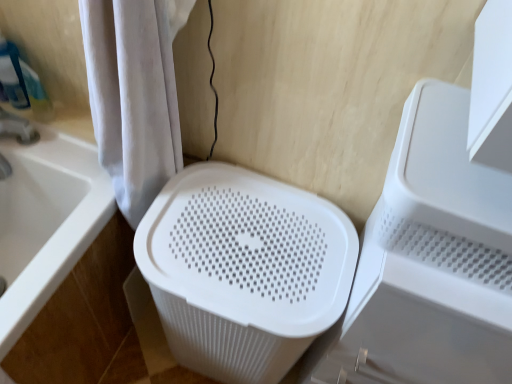
Question: Should I look upward or downward to see white plastic basket at center?

Choices:
 (A) down
 (B) up

Answer: (A)

Question: Considering the relative sizes of white plastic laundry basket at center and white plastic basket at center in the image provided, is white plastic laundry basket at center smaller than white plastic basket at center?

Choices:
 (A) yes
 (B) no

Answer: (B)

Question: Is white plastic laundry basket at center further to camera compared to white plastic basket at center?

Choices:
 (A) no
 (B) yes

Answer: (B)

Question: Considering the relative sizes of white plastic laundry basket at center and white plastic basket at center in the image provided, is white plastic laundry basket at center taller than white plastic basket at center?

Choices:
 (A) no
 (B) yes

Answer: (A)

Question: Considering the relative positions of white plastic laundry basket at center and white plastic basket at center in the image provided, is white plastic laundry basket at center to the left of white plastic basket at center from the viewer's perspective?

Choices:
 (A) yes
 (B) no

Answer: (A)

Question: Is white plastic laundry basket at center not close to white plastic basket at center?

Choices:
 (A) no
 (B) yes

Answer: (A)

Question: From the image's perspective, is white plastic laundry basket at center above white plastic basket at center?

Choices:
 (A) no
 (B) yes

Answer: (B)

Question: Is white plastic laundry basket at center facing away from white plastic bathtub at lower left?

Choices:
 (A) no
 (B) yes

Answer: (A)

Question: From the image's perspective, is white plastic laundry basket at center over white plastic bathtub at lower left?

Choices:
 (A) yes
 (B) no

Answer: (B)

Question: From a real-world perspective, is white plastic laundry basket at center on top of white plastic bathtub at lower left?

Choices:
 (A) no
 (B) yes

Answer: (B)

Question: Is the position of white plastic laundry basket at center less distant than that of white plastic bathtub at lower left?

Choices:
 (A) no
 (B) yes

Answer: (A)

Question: Are white plastic laundry basket at center and white plastic bathtub at lower left located far from each other?

Choices:
 (A) yes
 (B) no

Answer: (B)

Question: Does white plastic laundry basket at center appear on the left side of white plastic bathtub at lower left?

Choices:
 (A) no
 (B) yes

Answer: (A)

Question: From the image's perspective, is white plastic bathtub at lower left under velvet white shower curtain at left?

Choices:
 (A) no
 (B) yes

Answer: (B)